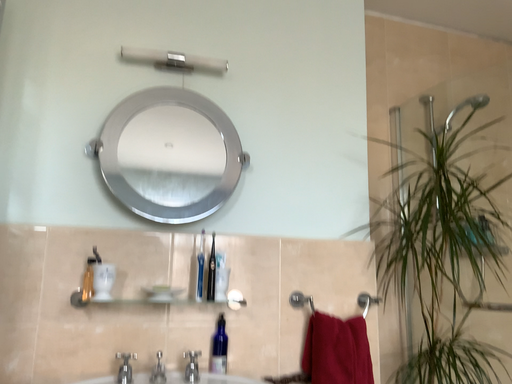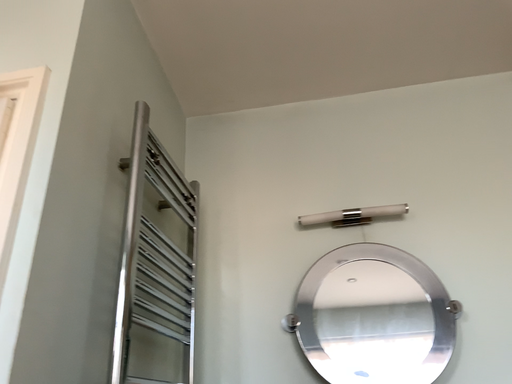
Question: Which way did the camera rotate in the video?

Choices:
 (A) rotated downward
 (B) rotated upward

Answer: (B)